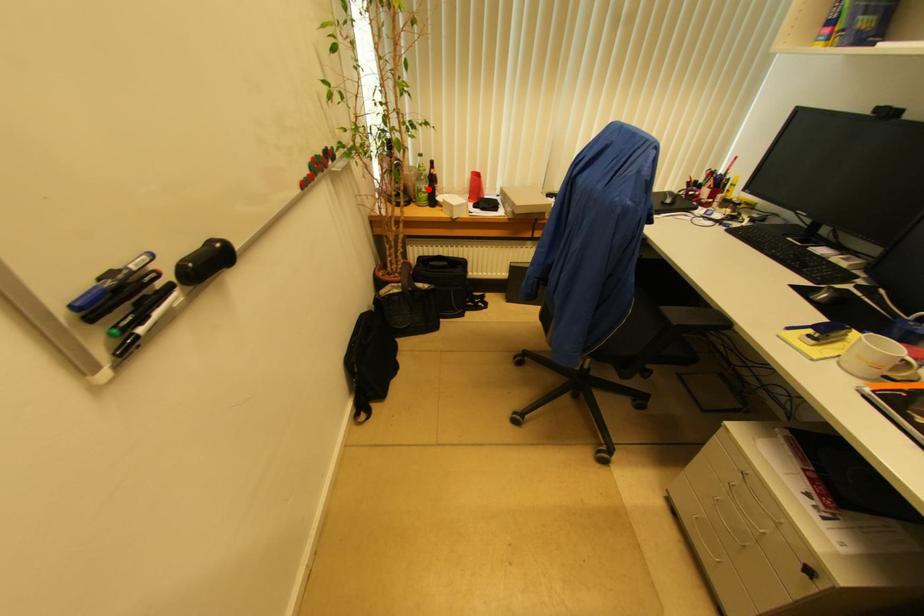
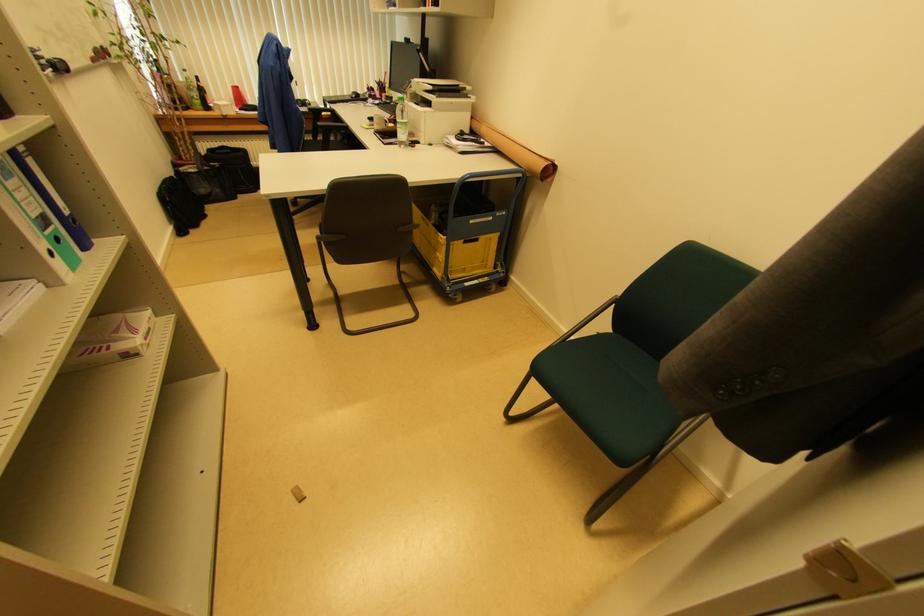
In the second image, find the point that corresponds to the highlighted location in the first image.

(200, 98)